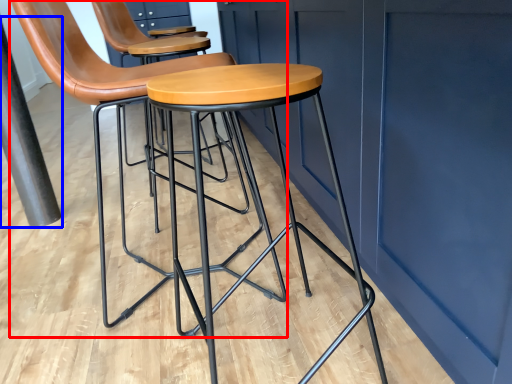
Question: Which of the following is the farthest to the observer, chair (highlighted by a red box) or pole (highlighted by a blue box)?

Choices:
 (A) chair
 (B) pole

Answer: (B)